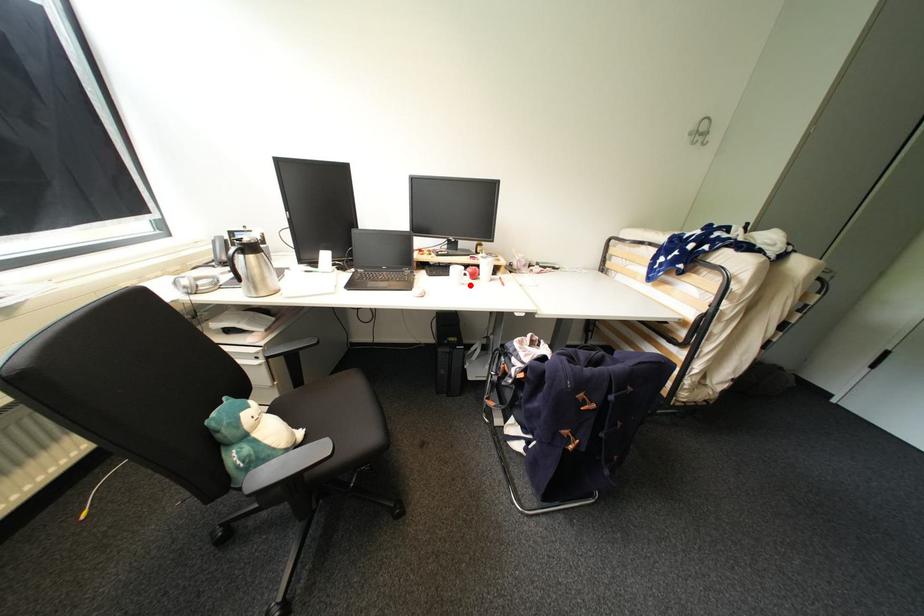
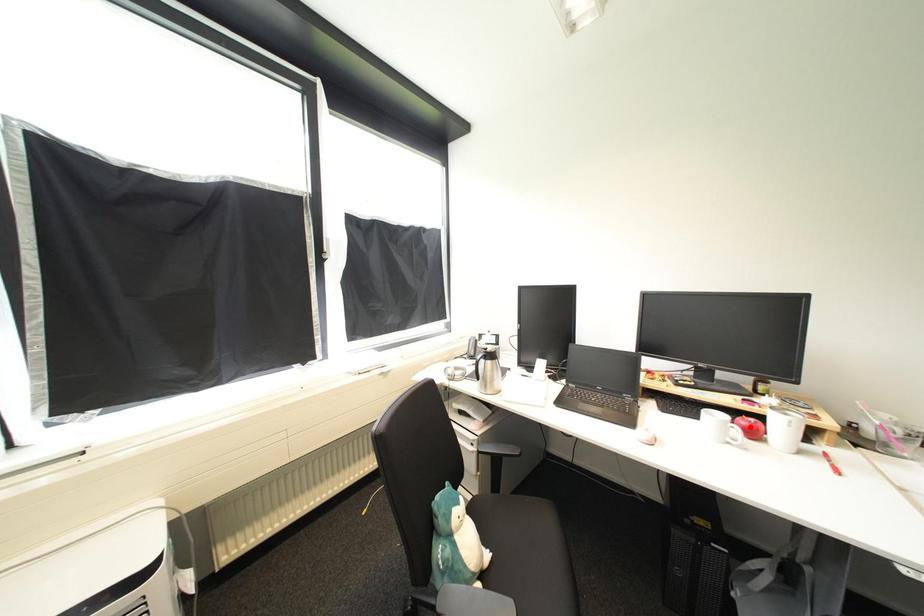
I am providing you with two images of the same scene from different viewpoints. A red point is marked on the first image and another point is marked on the second image. Does the point marked in image1 correspond to the same location as the one in image2?

No